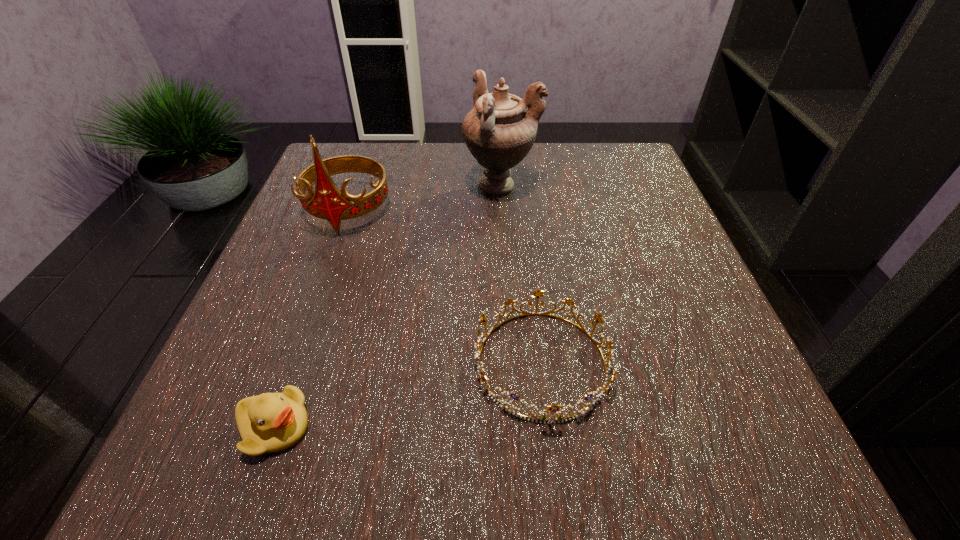
This screenshot has width=960, height=540. Identify the location of urn. (498, 131).

The height and width of the screenshot is (540, 960). Find the location of `the left tiara`. the left tiara is located at coordinates (328, 203).

Find the location of a particular element. This screenshot has height=540, width=960. the farther tiara is located at coordinates (328, 203).

Where is `duckling`? The image size is (960, 540). duckling is located at coordinates (270, 422).

Locate an element on the screen. the right tiara is located at coordinates (554, 408).

The image size is (960, 540). I want to click on the nearer tiara, so click(x=554, y=408).

Where is `vacant position located on the left of the urn`? vacant position located on the left of the urn is located at coordinates (437, 187).

Find the location of a particular element. This screenshot has width=960, height=540. vacant area situated on the front-facing side of the left tiara is located at coordinates (329, 261).

Locate an element on the screen. The image size is (960, 540). free location located 0.360m on the front-facing side of the duckling is located at coordinates click(x=578, y=427).

Find the location of a particular element. The image size is (960, 540). urn present at the far edge is located at coordinates (498, 131).